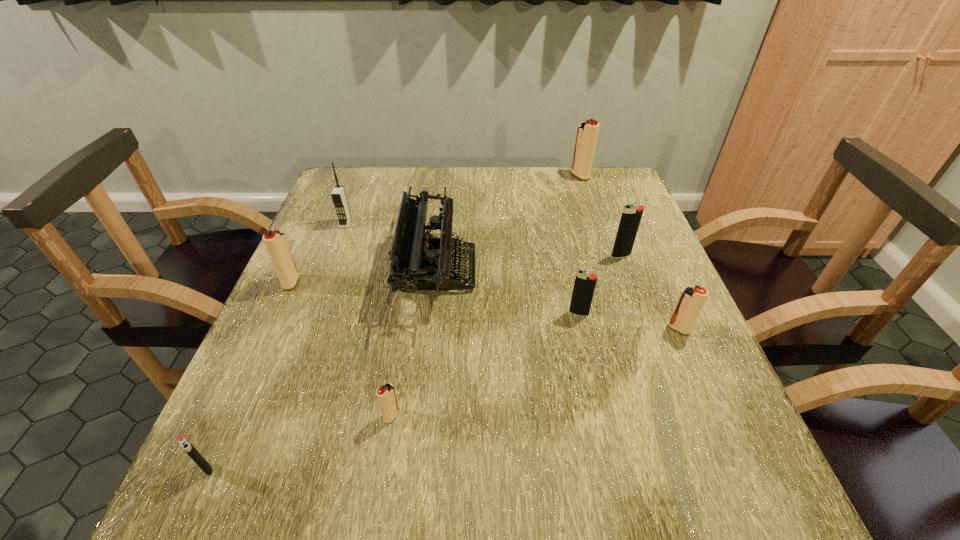
Find the location of a particular element. This screenshot has width=960, height=540. vacant area at the far edge is located at coordinates (495, 199).

In order to click on vacant space at the near edge in this screenshot , I will do `click(336, 463)`.

Where is `vacant position at the left edge of the desktop`? This screenshot has width=960, height=540. vacant position at the left edge of the desktop is located at coordinates (260, 386).

Find the location of `vacant space at the right edge of the desktop`. vacant space at the right edge of the desktop is located at coordinates (653, 262).

At what (x,y) coordinates should I click in order to perform the action: click on vacant space at the far left corner of the desktop. Please return your answer as a coordinate pair (x, y). The height and width of the screenshot is (540, 960). Looking at the image, I should click on (351, 190).

The width and height of the screenshot is (960, 540). In order to click on vacant area at the near right corner of the desktop in this screenshot , I will do `click(747, 482)`.

Locate an element on the screen. This screenshot has width=960, height=540. free spot between the biggest black igniter and the sixth object from left to right is located at coordinates (600, 284).

Image resolution: width=960 pixels, height=540 pixels. I want to click on free spot between the nearest red igniter and the sixth object from left to right, so click(485, 364).

Image resolution: width=960 pixels, height=540 pixels. I want to click on vacant area between the nearest black igniter and the rightmost black igniter, so click(414, 362).

Where is `empty space between the fifth nearest igniter and the sixth farthest igniter`? empty space between the fifth nearest igniter and the sixth farthest igniter is located at coordinates (342, 349).